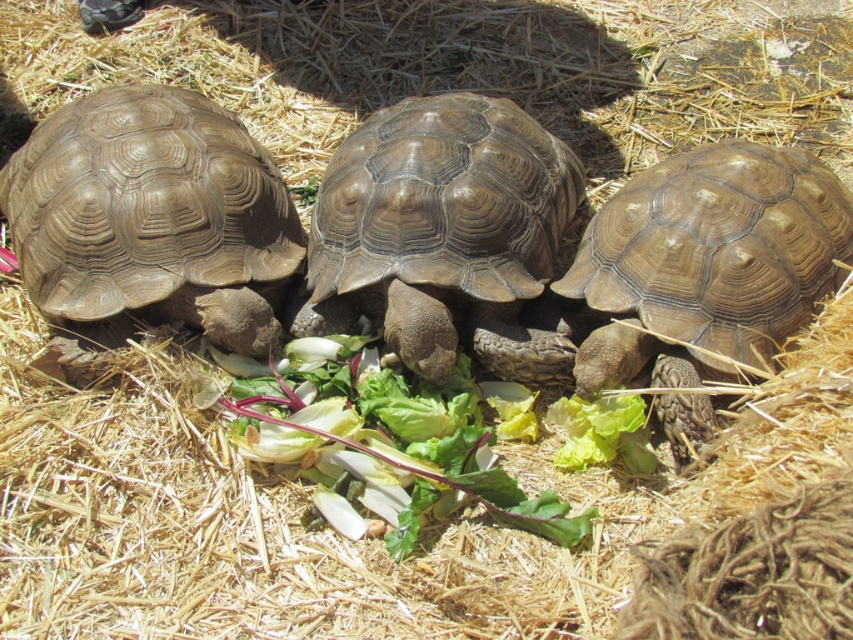
You are a researcher observing three tortoises on a bed of dry straw. You notice a point marked at coordinates (149, 224). Which object does this point correspond to?

The point at (149, 224) corresponds to the brown textured shell at left.